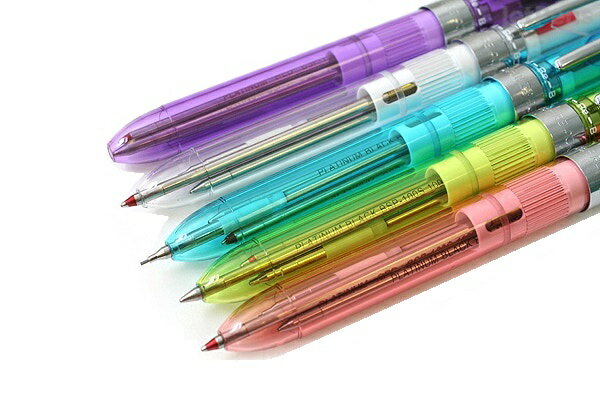
The width and height of the screenshot is (600, 400). Identify the location of pens. (253, 87), (267, 135), (293, 189), (339, 235), (366, 291).